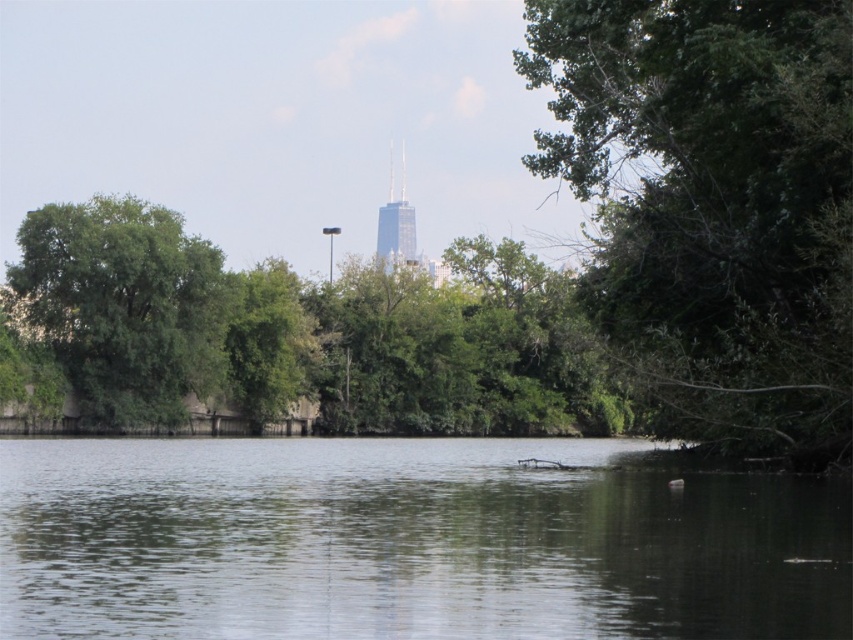
Does green reflective water at center come in front of green leafy tree at left?

Yes.

Does green reflective water at center have a lesser height compared to green leafy tree at left?

Correct, green reflective water at center is not as tall as green leafy tree at left.

Identify the location of green reflective water at center. (405, 541).

The image size is (853, 640). I want to click on green reflective water at center, so click(405, 541).

Between point (802, 448) and point (103, 310), which one is positioned behind?

The point (103, 310) is behind.

Is green leafy tree at right to the right of green leafy tree at left from the viewer's perspective?

Yes, green leafy tree at right is to the right of green leafy tree at left.

Is point (624, 244) closer to camera compared to point (138, 314)?

Yes.

The height and width of the screenshot is (640, 853). Identify the location of green leafy tree at right. (712, 204).

Locate an element on the screen. Image resolution: width=853 pixels, height=640 pixels. green reflective water at center is located at coordinates (405, 541).

Who is more forward, (x=93, y=499) or (x=715, y=113)?

Point (x=93, y=499) is more forward.

The height and width of the screenshot is (640, 853). Identify the location of green reflective water at center. (405, 541).